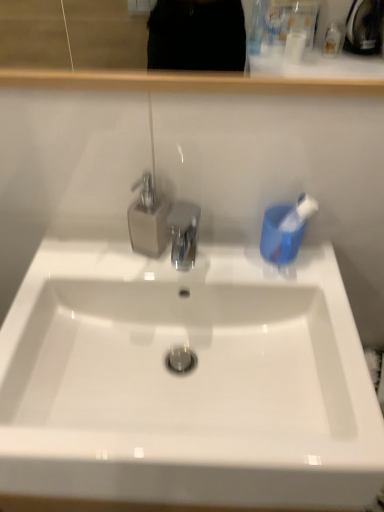
The image size is (384, 512). Find the location of `free region on the left part of transparent plastic tap at center`. free region on the left part of transparent plastic tap at center is located at coordinates (79, 256).